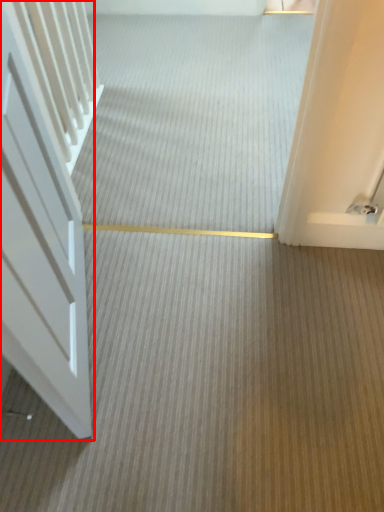
Question: From the image's perspective, what is the correct spatial relationship of door (annotated by the red box) in relation to plain?

Choices:
 (A) below
 (B) above

Answer: (A)